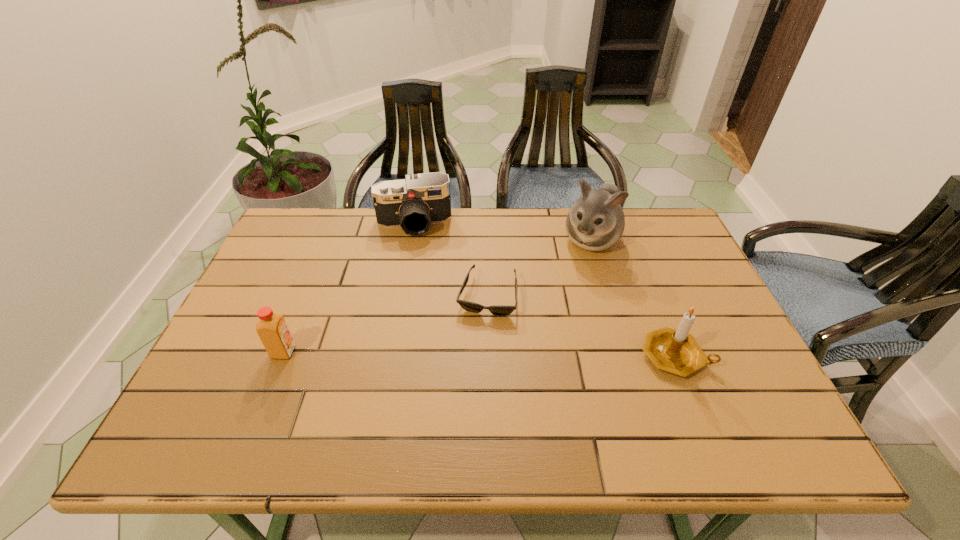
Where is `free spot on the desktop that is between the leftmost object and the candle holder and is positioned on the face of the tallest object`? free spot on the desktop that is between the leftmost object and the candle holder and is positioned on the face of the tallest object is located at coordinates (527, 355).

I want to click on free space on the desktop that is between the leftmost object and the candle holder and is positioned on the front-facing side of the third object from right to left, so click(474, 354).

At what (x,y) coordinates should I click in order to perform the action: click on free space on the desktop that is between the orange juice and the candle holder and is positioned on the front-facing side of the camera. Please return your answer as a coordinate pair (x, y). Looking at the image, I should click on (427, 354).